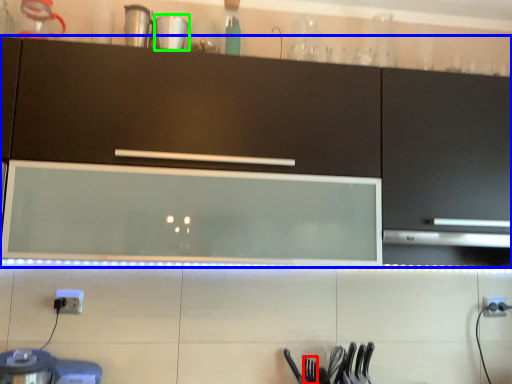
Question: Estimate the real-world distances between objects in this image. Which object is closer to silverware (highlighted by a red box), cabinetry (highlighted by a blue box) or tableware (highlighted by a green box)?

Choices:
 (A) cabinetry
 (B) tableware

Answer: (A)